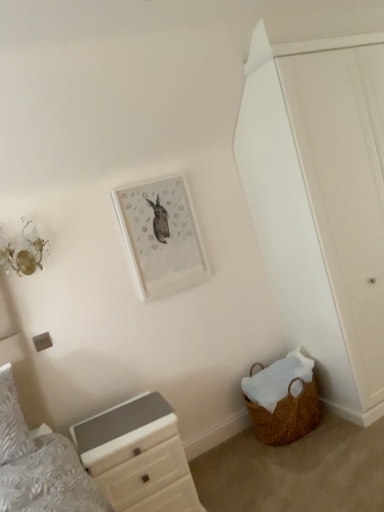
The width and height of the screenshot is (384, 512). What do you see at coordinates (138, 456) in the screenshot? I see `white glossy chest of drawers at lower left` at bounding box center [138, 456].

The height and width of the screenshot is (512, 384). What do you see at coordinates (283, 399) in the screenshot?
I see `brown woven basket at lower right` at bounding box center [283, 399].

What is the approximate width of matte white picture frame at upper center?

2.30 inches.

Describe the element at coordinates (161, 236) in the screenshot. I see `matte white picture frame at upper center` at that location.

Identify the location of white matte door at right. The height and width of the screenshot is (512, 384). (345, 190).

This screenshot has height=512, width=384. Find the location of `white glossy chest of drawers at lower left`. white glossy chest of drawers at lower left is located at coordinates (138, 456).

Would you say white glossy chest of drawers at lower left is part of white textured pillow at left's contents?

No, white glossy chest of drawers at lower left is not surrounded by white textured pillow at left.

In the scene shown: From a real-world perspective, between white textured pillow at left and white glossy chest of drawers at lower left, who is vertically lower?

white glossy chest of drawers at lower left, from a real-world perspective.

Does point (5, 415) come farther from viewer compared to point (110, 414)?

That is False.

I want to click on pillow on the left of white glossy chest of drawers at lower left, so click(x=12, y=421).

Is matte white picture frame at upper center looking in the opposite direction of brown woven basket at lower right?

matte white picture frame at upper center is not turned away from brown woven basket at lower right.

Is there a large distance between matte white picture frame at upper center and brown woven basket at lower right?

That's not correct — matte white picture frame at upper center is a little close to brown woven basket at lower right.

Looking at their sizes, would you say matte white picture frame at upper center is wider or thinner than brown woven basket at lower right?

matte white picture frame at upper center is thinner than brown woven basket at lower right.

Which is closer, [120,216] or [281,436]?

Point [120,216] is closer to the camera than point [281,436].

Can we say white glossy chest of drawers at lower left lies outside white textured pillow at left?

Yes, white glossy chest of drawers at lower left is not within white textured pillow at left.

Does white glossy chest of drawers at lower left turn towards white textured pillow at left?

No, white glossy chest of drawers at lower left is not facing towards white textured pillow at left.

Considering the positions of objects white glossy chest of drawers at lower left and white textured pillow at left in the image provided, who is in front, white glossy chest of drawers at lower left or white textured pillow at left?

white glossy chest of drawers at lower left is in front.

Considering the sizes of white glossy chest of drawers at lower left and white textured pillow at left in the image, is white glossy chest of drawers at lower left taller or shorter than white textured pillow at left?

In the image, white glossy chest of drawers at lower left appears to be taller than white textured pillow at left.

From the image's perspective, is white glossy chest of drawers at lower left above or below matte white picture frame at upper center?

From the image's perspective, white glossy chest of drawers at lower left appears below matte white picture frame at upper center.

Is white glossy chest of drawers at lower left oriented towards matte white picture frame at upper center?

No, white glossy chest of drawers at lower left is not turned towards matte white picture frame at upper center.

Is white glossy chest of drawers at lower left taller than matte white picture frame at upper center?

No.

From a real-world perspective, is white glossy chest of drawers at lower left physically located above or below matte white picture frame at upper center?

white glossy chest of drawers at lower left is situated lower than matte white picture frame at upper center in the real world.

Are white textured pillow at left and matte white picture frame at upper center beside each other?

No, white textured pillow at left is not beside matte white picture frame at upper center.

Consider the image. Is white textured pillow at left in front of matte white picture frame at upper center?

Yes, white textured pillow at left is closer to the viewer.

Is white textured pillow at left oriented towards matte white picture frame at upper center?

No.

Is brown woven basket at lower right oriented towards matte white picture frame at upper center?

No, brown woven basket at lower right does not turn towards matte white picture frame at upper center.

Is brown woven basket at lower right at the right side of matte white picture frame at upper center?

Indeed, brown woven basket at lower right is positioned on the right side of matte white picture frame at upper center.

Consider the image. Is brown woven basket at lower right placed right next to matte white picture frame at upper center?

There is a gap between brown woven basket at lower right and matte white picture frame at upper center.

From a real-world perspective, which is physically below, white glossy chest of drawers at lower left or white matte door at right?

white glossy chest of drawers at lower left.

Is point (70, 430) in front of point (363, 232)?

Yes, it is in front of point (363, 232).

Would you consider white glossy chest of drawers at lower left to be distant from white matte door at right?

Yes, white glossy chest of drawers at lower left and white matte door at right are located far from each other.

Between white glossy chest of drawers at lower left and white matte door at right, which one has larger size?

white matte door at right is bigger.

The image size is (384, 512). Identify the location of pillow above the white glossy chest of drawers at lower left (from the image's perspective). (12, 421).

At what (x,y) coordinates should I click in order to perform the action: click on picture frame on the left of brown woven basket at lower right. Please return your answer as a coordinate pair (x, y). This screenshot has height=512, width=384. Looking at the image, I should click on (161, 236).

Based on their spatial positions, is white matte door at right or brown woven basket at lower right closer to white glossy chest of drawers at lower left?

Based on the image, brown woven basket at lower right appears to be nearer to white glossy chest of drawers at lower left.

Considering their positions, is white glossy chest of drawers at lower left positioned closer to matte white picture frame at upper center than white matte door at right?

white glossy chest of drawers at lower left lies closer to matte white picture frame at upper center than the other object.

Considering their positions, is brown woven basket at lower right positioned further to white textured pillow at left than white glossy chest of drawers at lower left?

brown woven basket at lower right is positioned further to the anchor white textured pillow at left.

Estimate the real-world distances between objects in this image. Which object is closer to white matte door at right, brown woven basket at lower right or white glossy chest of drawers at lower left?

The object closer to white matte door at right is brown woven basket at lower right.

Looking at the image, which one is located closer to brown woven basket at lower right, white matte door at right or matte white picture frame at upper center?

white matte door at right lies closer to brown woven basket at lower right than the other object.

Considering their positions, is white matte door at right positioned further to matte white picture frame at upper center than white glossy chest of drawers at lower left?

Based on the image, white matte door at right appears to be further to matte white picture frame at upper center.

When comparing their distances from matte white picture frame at upper center, does brown woven basket at lower right or white textured pillow at left seem further?

white textured pillow at left.

In the scene shown: Looking at the image, which one is located closer to white glossy chest of drawers at lower left, white textured pillow at left or matte white picture frame at upper center?

Based on the image, white textured pillow at left appears to be nearer to white glossy chest of drawers at lower left.

This screenshot has height=512, width=384. I want to click on picture frame situated between white glossy chest of drawers at lower left and white matte door at right from left to right, so click(x=161, y=236).

The width and height of the screenshot is (384, 512). I want to click on basket between white matte door at right and white glossy chest of drawers at lower left in the vertical direction, so click(x=283, y=399).

This screenshot has width=384, height=512. Identify the location of picture frame between white textured pillow at left and white matte door at right in the horizontal direction. (161, 236).

Identify the location of picture frame located between white textured pillow at left and brown woven basket at lower right in the left-right direction. (161, 236).